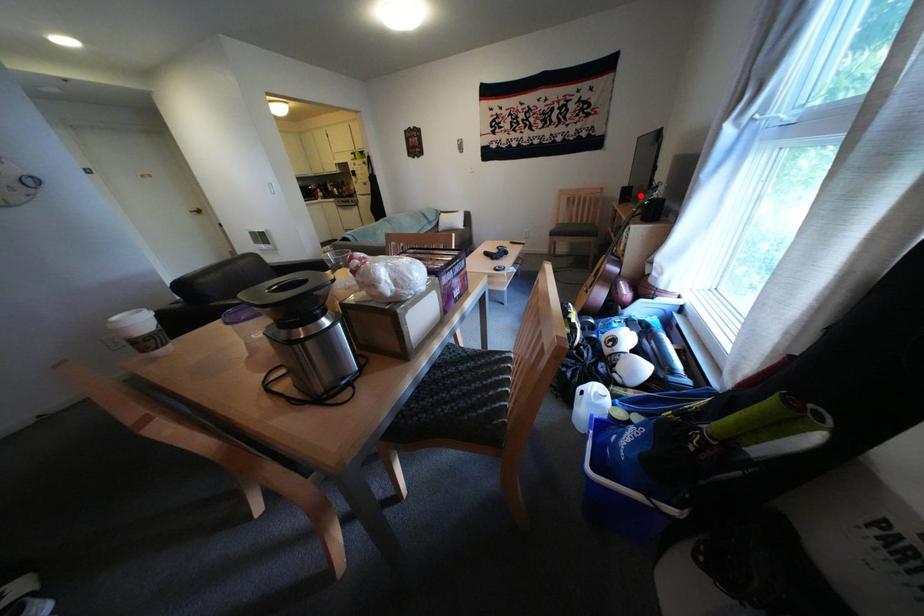
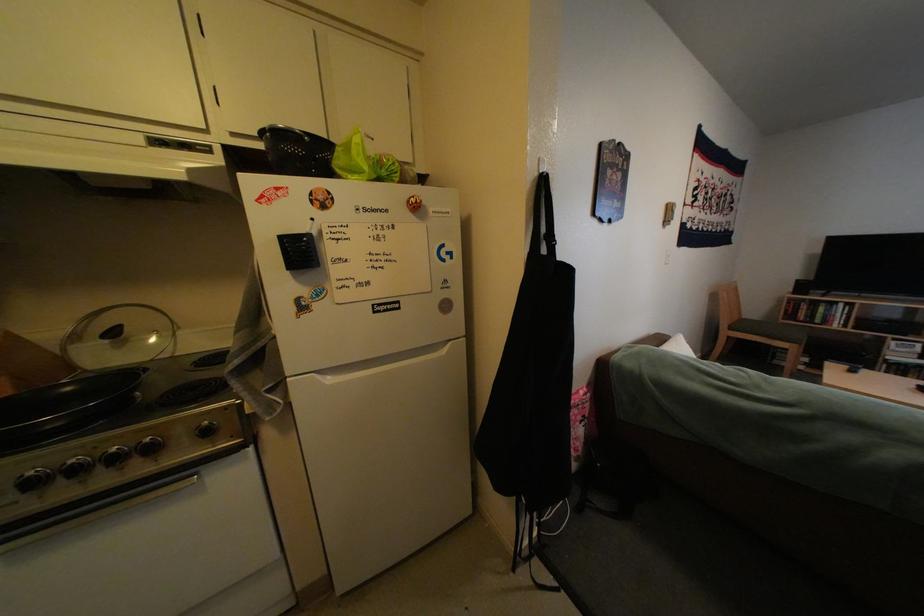
Find the pixel in the second image that matches the highlighted location in the first image.

(816, 288)